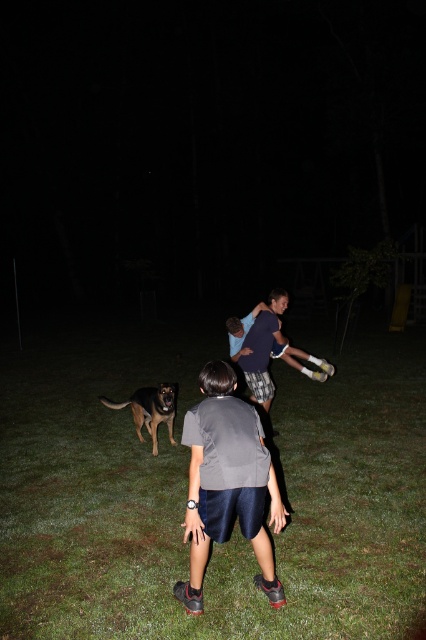
Which is behind, point (28, 596) or point (164, 397)?

Point (164, 397)

Can you confirm if green grass at center is thinner than brown fur dog at lower left?

In fact, green grass at center might be wider than brown fur dog at lower left.

Who is more distant from viewer, (x=314, y=541) or (x=134, y=400)?

Positioned behind is point (x=134, y=400).

The width and height of the screenshot is (426, 640). I want to click on green grass at center, so click(186, 493).

Based on the photo, who is more distant from viewer, [244,456] or [149,410]?

Point [149,410]

The image size is (426, 640). Identify the location of gray fabric shirt at center. (227, 483).

Which is behind, point (247, 506) or point (154, 440)?

The point (154, 440) is behind.

Locate an element on the screen. The height and width of the screenshot is (640, 426). gray fabric shirt at center is located at coordinates coord(227,483).

Does green grass at center appear over gray fabric shirt at center?

No, green grass at center is not above gray fabric shirt at center.

Consider the image. Is green grass at center wider than gray fabric shirt at center?

Correct, the width of green grass at center exceeds that of gray fabric shirt at center.

Measure the distance between green grass at center and camera.

green grass at center and camera are 3.25 meters apart.

At what (x,y) coordinates should I click in order to perform the action: click on green grass at center. Please return your answer as a coordinate pair (x, y). The width and height of the screenshot is (426, 640). Looking at the image, I should click on (186, 493).